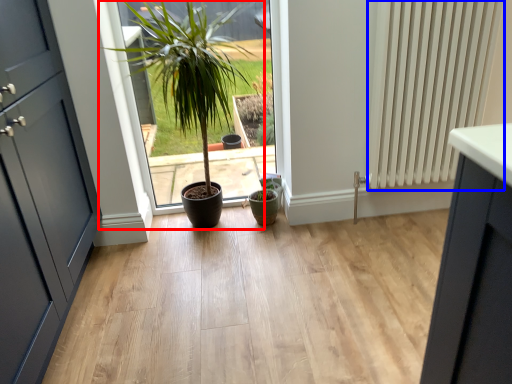
Question: Among these objects, which one is nearest to the camera, houseplant (highlighted by a red box) or radiator (highlighted by a blue box)?

Choices:
 (A) houseplant
 (B) radiator

Answer: (A)